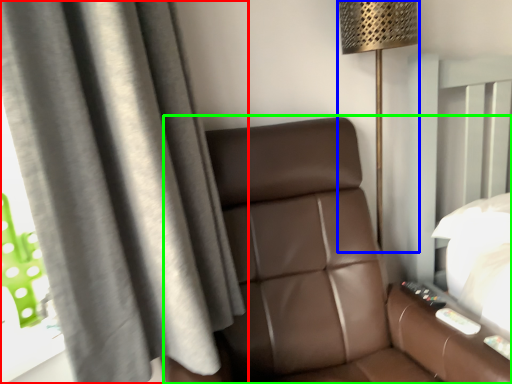
Question: Which object is the farthest from curtain (highlighted by a red box)? Choose among these: lamp (highlighted by a blue box) or furniture (highlighted by a green box).

Choices:
 (A) lamp
 (B) furniture

Answer: (A)